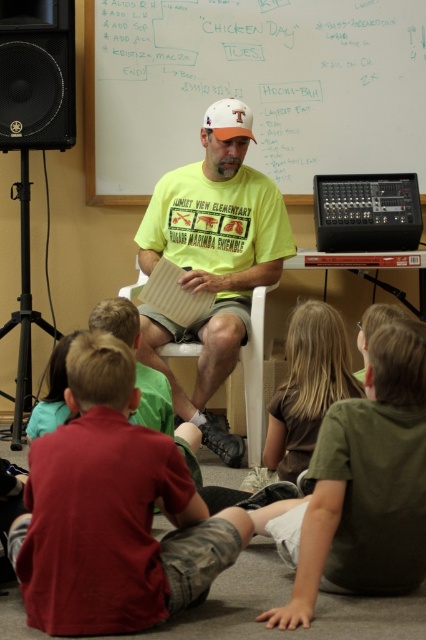
You are a student in the classroom and need to write a note to the teacher. Which object, the whiteboard at upper center or the black matte speaker at upper left, is better for writing your note on?

The whiteboard at upper center is larger in size than the black matte speaker at upper left, so it is better for writing your note on.

You are a student in the classroom. You need to write a note on the whiteboard at upper center and the brown smooth shirt at lower center. Which surface can you write on?

The whiteboard at upper center can be written on because it has a smooth surface designed for writing, while the brown smooth shirt at lower center is clothing and not meant for writing.

You are standing at the entrance of the classroom and see the point marked at coordinates [213,268]. What object is located at that point?

The point at [213,268] marks the yellow t shirt at center.